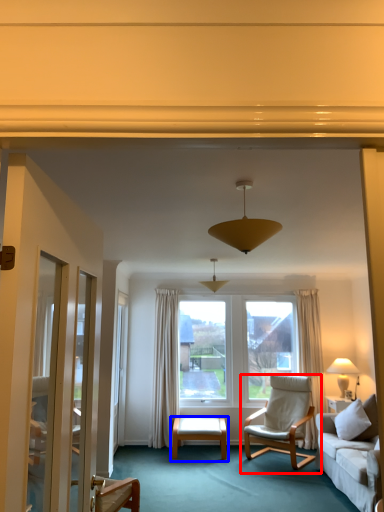
Question: Which of the following is the closest to the observer, chair (highlighted by a red box) or table (highlighted by a blue box)?

Choices:
 (A) chair
 (B) table

Answer: (A)